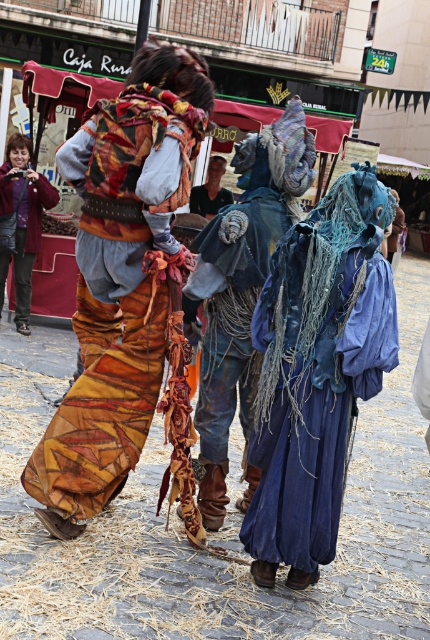
Does blue fabric dress at center appear on the left side of matte purple jacket at left?

No, blue fabric dress at center is not to the left of matte purple jacket at left.

Is point (389, 324) positioned after point (0, 200)?

No.

Find the location of a particular element. blue fabric dress at center is located at coordinates (313, 396).

Is the position of textured brown fabric at center more distant than that of blue textured fabric at center?

No, it is not.

Which is in front, point (80, 518) or point (199, 292)?

Point (80, 518)

Who is more forward, [162,285] or [226,298]?

Point [162,285] is in front.

Identify the location of textured brown fabric at center. This screenshot has width=430, height=640. (117, 296).

Consider the image. Can you confirm if velvet-like fabric glove at center is smaller than blue fabric at center?

Indeed, velvet-like fabric glove at center has a smaller size compared to blue fabric at center.

Is point (194, 209) positioned before point (393, 230)?

Yes.

Which is in front, point (202, 200) or point (404, 212)?

Point (202, 200) is in front.

Locate an element on the screen. The height and width of the screenshot is (640, 430). velvet-like fabric glove at center is located at coordinates (208, 200).